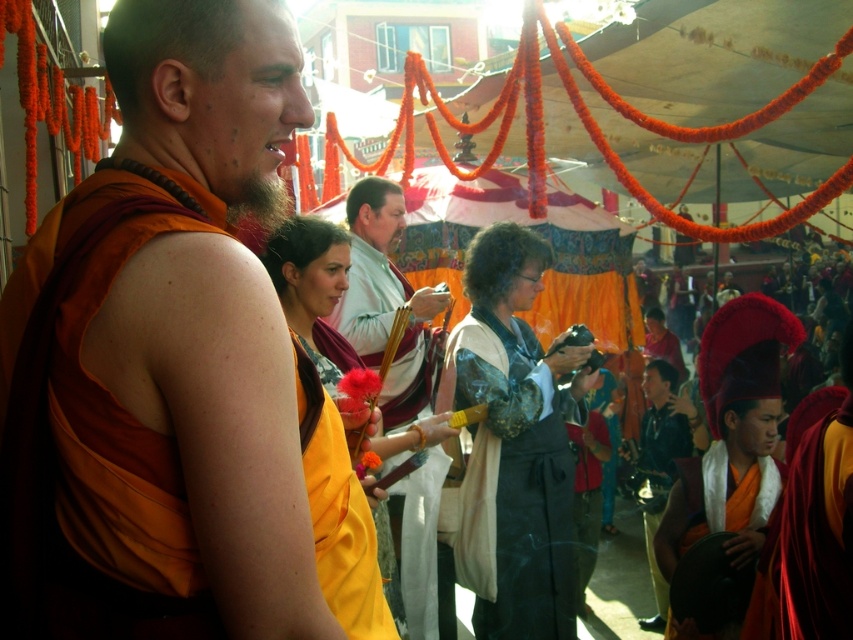
Does point (560, 632) come farther from viewer compared to point (399, 228)?

No, it is not.

Can you confirm if silky black robe at center is smaller than matte white robe at center?

Yes.

The width and height of the screenshot is (853, 640). Describe the element at coordinates (521, 492) in the screenshot. I see `silky black robe at center` at that location.

I want to click on silky black robe at center, so click(521, 492).

Can you confirm if matte orange robe at center is shorter than matte white robe at center?

Yes, matte orange robe at center is shorter than matte white robe at center.

Who is higher up, matte orange robe at center or matte white robe at center?

Positioned higher is matte white robe at center.

The height and width of the screenshot is (640, 853). Describe the element at coordinates (177, 365) in the screenshot. I see `matte orange robe at center` at that location.

You are a GUI agent. You are given a task and a screenshot of the screen. Output one action in this format:
    pyautogui.click(x=<x>, y=<y>)
    Task: Click on the matte orange robe at center
    This screenshot has width=853, height=640.
    Given the screenshot: What is the action you would take?
    pyautogui.click(x=177, y=365)

Does matte orange robe at center appear on the left side of silky black robe at center?

Yes, matte orange robe at center is to the left of silky black robe at center.

Between matte orange robe at center and silky black robe at center, which one has less height?

Standing shorter between the two is matte orange robe at center.

Measure the distance between matte orange robe at center and camera.

matte orange robe at center and camera are 2.17 meters apart.

I want to click on matte orange robe at center, so pos(177,365).